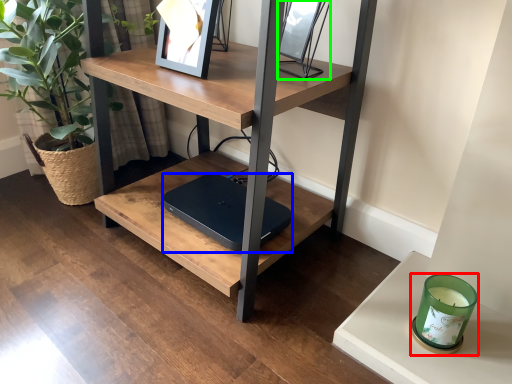
Question: Considering the real-world distances, which object is closest to candle holder (highlighted by a red box)? laptop (highlighted by a blue box) or picture frame (highlighted by a green box).

Choices:
 (A) laptop
 (B) picture frame

Answer: (A)